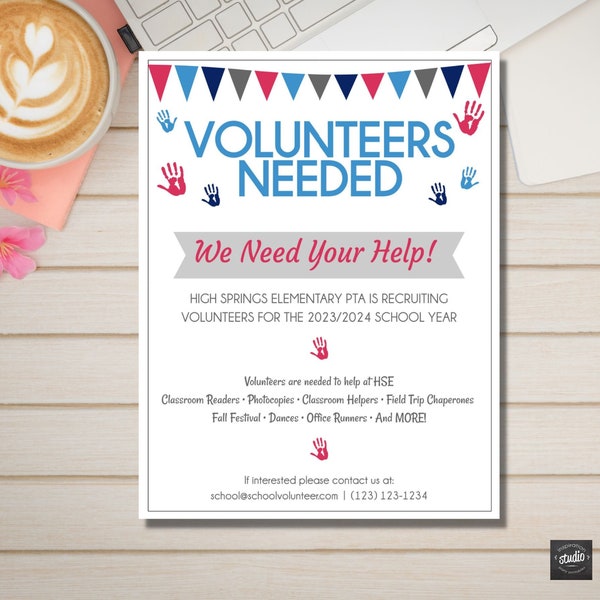
The height and width of the screenshot is (600, 600). Identify the location of computer keys. (285, 27).